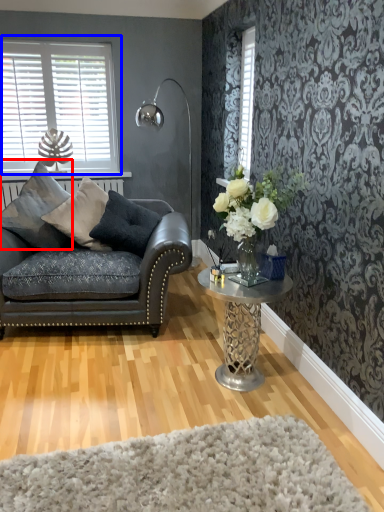
Question: Which point is further to the camera, pillow (highlighted by a red box) or window (highlighted by a blue box)?

Choices:
 (A) pillow
 (B) window

Answer: (B)